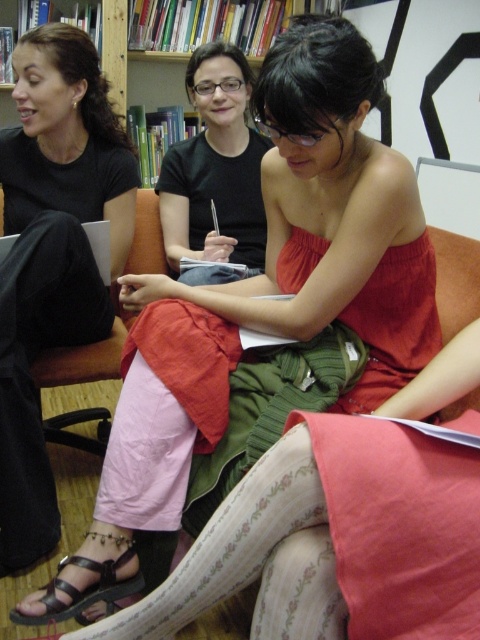
You are a photographer trying to capture a candid shot of the matte black shirt at center and the black leather sandal at lower left. Since you want to ensure both subjects are in focus, you need to know their vertical positioning. Which one is positioned higher in the frame?

The matte black shirt at center is located above the black leather sandal at lower left, so it is positioned higher in the frame.

You are designing a layout for a group photo and need to ensure that the matte black shirt at center and the black leather sandal at lower left are visible. Considering their sizes, which object should be placed closer to the camera to maintain visibility?

The matte black shirt at center is wider than the black leather sandal at lower left, so placing the matte black shirt at center closer to the camera will help maintain its visibility since larger objects can be positioned nearer without appearing too dominant.

You are standing in the room and want to locate the pink fabric skirt at lower left. Where exactly can you find it?

The pink fabric skirt at lower left is located at point (52, 256).